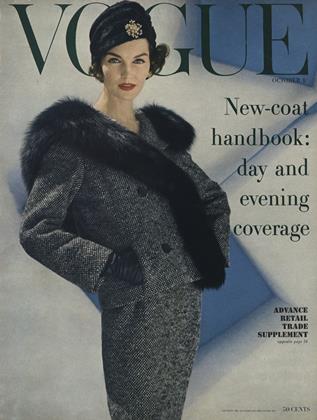
What are the coordinates of `coat` in the screenshot? It's located at (199, 248).